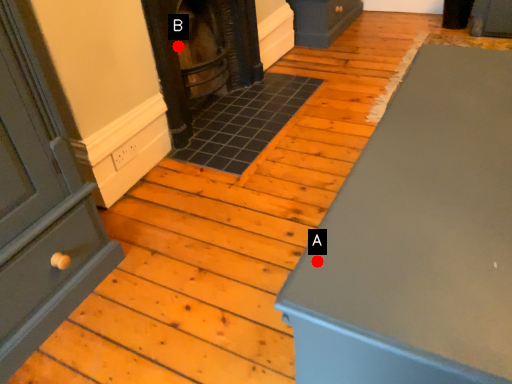
Question: Two points are circled on the image, labeled by A and B beside each circle. Which of the following is the farthest from the observer?

Choices:
 (A) A is further
 (B) B is further

Answer: (B)